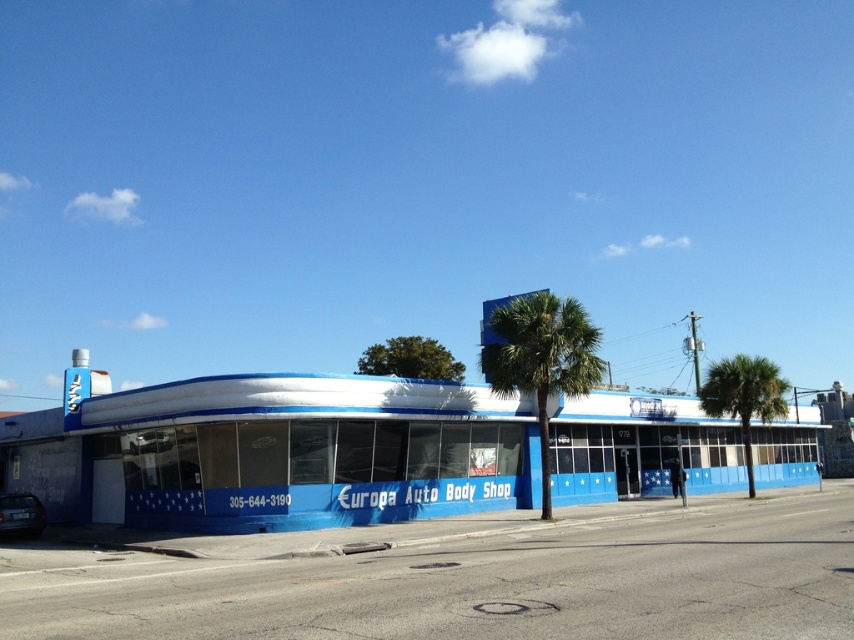
Question: Which of these objects is positioned closest to the green leafy palm tree at right?

Choices:
 (A) shiny black car at lower left
 (B) green leafy palm tree at center

Answer: (B)

Question: Which point is closer to the camera?

Choices:
 (A) shiny black car at lower left
 (B) green leafy palm tree at right

Answer: (A)

Question: Does green leafy palm tree at center have a larger size compared to green leafy palm tree at right?

Choices:
 (A) no
 (B) yes

Answer: (A)

Question: Can you confirm if green leafy palm tree at center is positioned to the left of shiny black car at lower left?

Choices:
 (A) no
 (B) yes

Answer: (A)

Question: Observing the image, what is the correct spatial positioning of green leafy palm tree at center in reference to green leafy palm tree at right?

Choices:
 (A) left
 (B) right

Answer: (A)

Question: Which point appears closest to the camera in this image?

Choices:
 (A) (714, 394)
 (B) (565, 348)

Answer: (B)